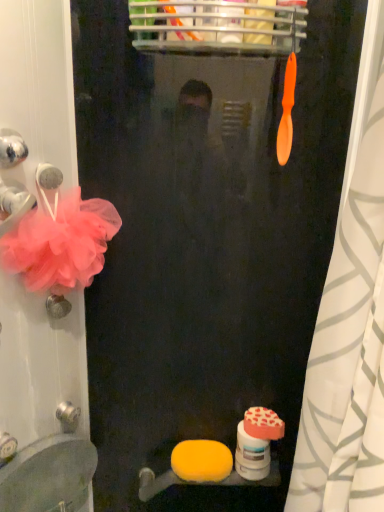
Question: Is yellow sponge at lower center, which is the first soap in bottom-to-top order, taller than pink tulle flower at left?

Choices:
 (A) no
 (B) yes

Answer: (A)

Question: From the image's perspective, is yellow sponge at lower center, which is the first soap in bottom-to-top order, under pink tulle flower at left?

Choices:
 (A) no
 (B) yes

Answer: (B)

Question: Is yellow sponge at lower center, which appears as the second soap when viewed from the right, facing away from pink tulle flower at left?

Choices:
 (A) yes
 (B) no

Answer: (B)

Question: Can you confirm if yellow sponge at lower center, which is the first soap from left to right, is bigger than pink tulle flower at left?

Choices:
 (A) no
 (B) yes

Answer: (A)

Question: Is yellow sponge at lower center, arranged as the second soap when viewed from the top, beside pink tulle flower at left?

Choices:
 (A) no
 (B) yes

Answer: (A)

Question: From the image's perspective, is orange matte heart-shaped soap at lower right, arranged as the 2th soap when viewed from the left, positioned above or below orange plastic toothbrush at upper center?

Choices:
 (A) below
 (B) above

Answer: (A)

Question: Is point (269, 423) closer or farther from the camera than point (291, 106)?

Choices:
 (A) closer
 (B) farther

Answer: (B)

Question: From a real-world perspective, is orange matte heart-shaped soap at lower right, positioned as the 2th soap in bottom-to-top order, physically located above or below orange plastic toothbrush at upper center?

Choices:
 (A) below
 (B) above

Answer: (A)

Question: Would you say orange matte heart-shaped soap at lower right, arranged as the 2th soap when viewed from the left, is to the left or to the right of orange plastic toothbrush at upper center in the picture?

Choices:
 (A) left
 (B) right

Answer: (A)

Question: Visually, is matte white sink at lower left positioned to the left or to the right of white matte toilet paper at lower center?

Choices:
 (A) left
 (B) right

Answer: (A)

Question: In terms of height, does matte white sink at lower left look taller or shorter compared to white matte toilet paper at lower center?

Choices:
 (A) short
 (B) tall

Answer: (B)

Question: From the image's perspective, is matte white sink at lower left located above or below white matte toilet paper at lower center?

Choices:
 (A) below
 (B) above

Answer: (A)

Question: Considering the positions of matte white sink at lower left and white matte toilet paper at lower center in the image, is matte white sink at lower left wider or thinner than white matte toilet paper at lower center?

Choices:
 (A) wide
 (B) thin

Answer: (A)

Question: Considering their positions, is white matte toilet paper at lower center located in front of or behind yellow sponge at lower center, which is the first soap in bottom-to-top order?

Choices:
 (A) behind
 (B) front

Answer: (B)

Question: Looking at the image, does white matte toilet paper at lower center seem bigger or smaller compared to yellow sponge at lower center, which appears as the second soap when viewed from the right?

Choices:
 (A) small
 (B) big

Answer: (B)